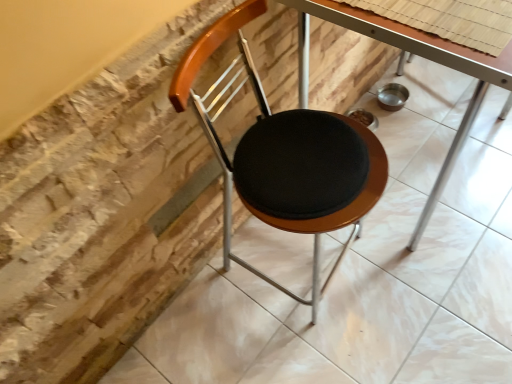
Where is `vacant region to the left of matte black seat at center`? This screenshot has width=512, height=384. vacant region to the left of matte black seat at center is located at coordinates (212, 320).